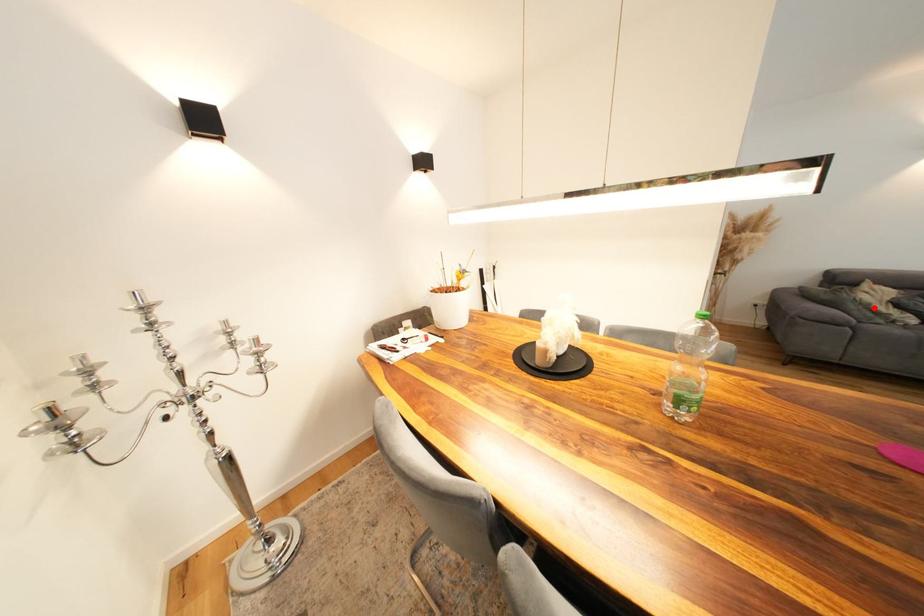
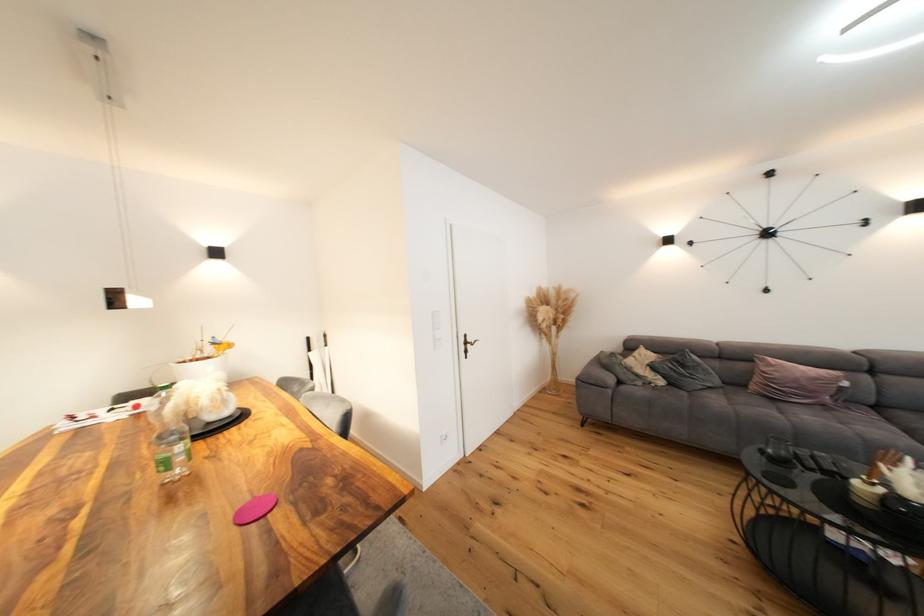
Question: I am providing you with two images of the same scene from different viewpoints. Image1 has a red point marked. In image2, the corresponding 3D location appears at what relative position? Reply with the corresponding letter.

Choices:
 (A) Closer
 (B) Farther

Answer: (A)